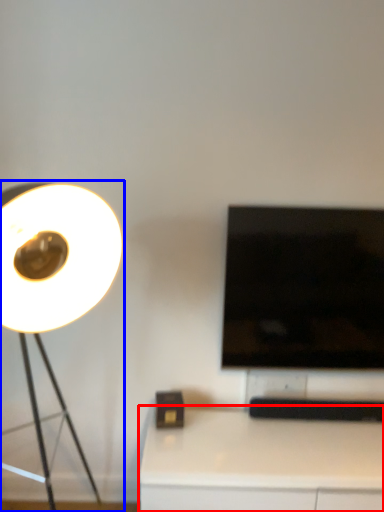
Question: Among these objects, which one is farthest to the camera, table (highlighted by a red box) or lamp (highlighted by a blue box)?

Choices:
 (A) table
 (B) lamp

Answer: (A)